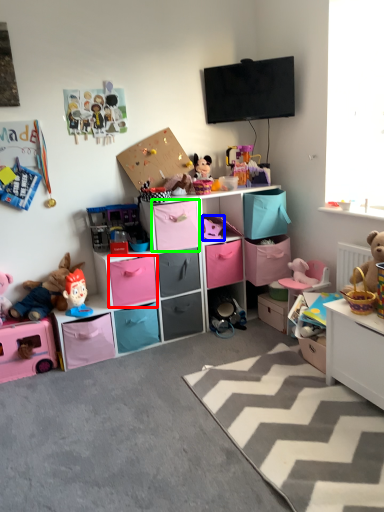
Question: Which object is positioned closest to drawer (highlighted by a red box)? Select from toy (highlighted by a blue box) and cabinet (highlighted by a green box).

Choices:
 (A) toy
 (B) cabinet

Answer: (B)